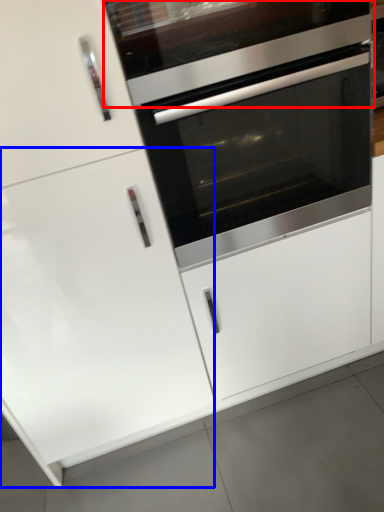
Question: Which point is closer to the camera, vent (highlighted by a red box) or door (highlighted by a blue box)?

Choices:
 (A) vent
 (B) door

Answer: (B)